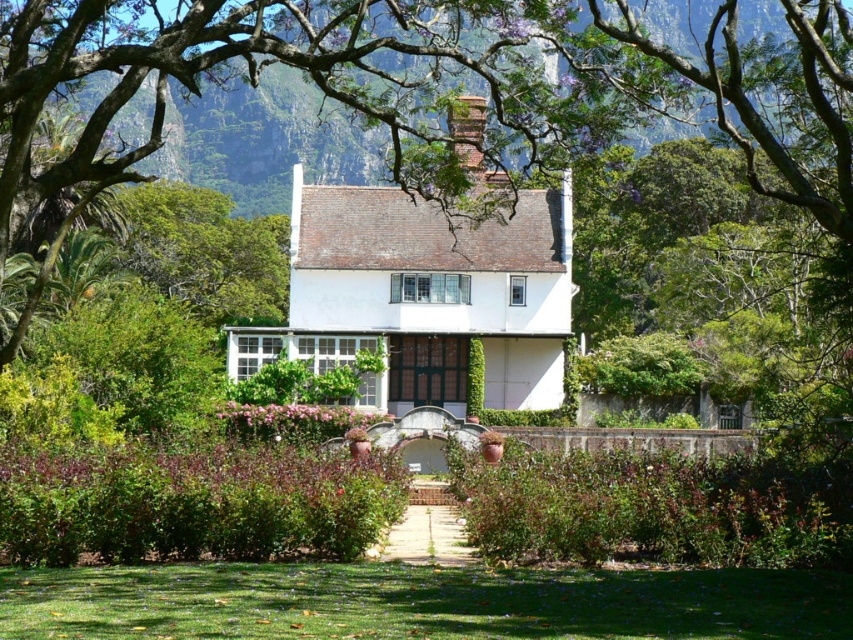
You are standing in the garden of the house and want to walk from the green grass at lower center to the green leafy tree at upper center. Which direction should you face to walk towards the tree?

You should face to the left to walk towards the green leafy tree at upper center since it is located to the left of the green grass at lower center.

You are standing at the entrance of the house and want to place a small garden statue exactly at the center of the green grass at lower center. According to the image, what are the coordinates where you should place the statue?

The coordinates for the center of the green grass at lower center are at point (419,602).